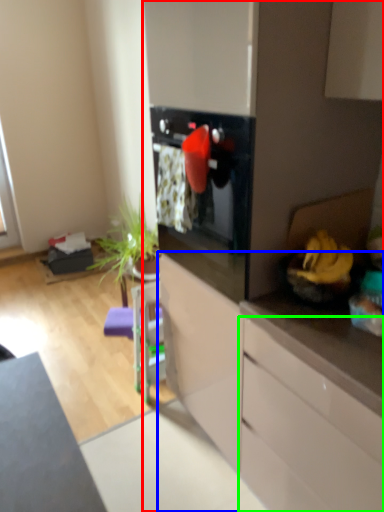
Question: Considering the real-world distances, which object is closest to dresser (highlighted by a red box)? cabinetry (highlighted by a blue box) or cabinetry (highlighted by a green box).

Choices:
 (A) cabinetry
 (B) cabinetry

Answer: (A)